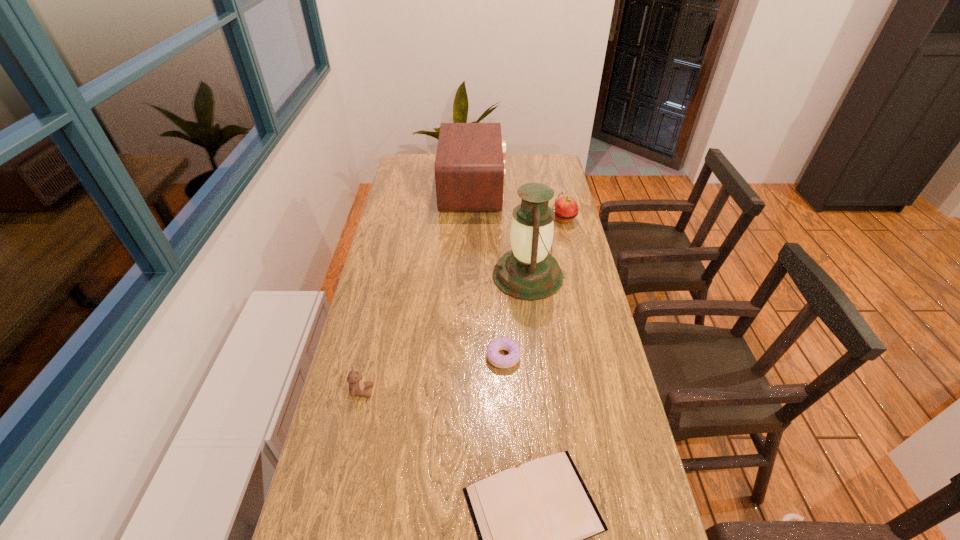
Find the location of a particular element. This screenshot has width=960, height=540. free space located with the light compartment facing forward on the tallest object is located at coordinates click(x=467, y=276).

The height and width of the screenshot is (540, 960). Find the location of `vacant region located on the front panel of the radio receiver`. vacant region located on the front panel of the radio receiver is located at coordinates (561, 189).

Identify the location of free space located on the left of the apple. This screenshot has width=960, height=540. (460, 219).

Find the location of a particular element. The image size is (960, 540). vacant space located on the front-facing side of the leftmost object is located at coordinates (428, 392).

I want to click on free location located 0.300m on the front of the second shortest object, so click(x=509, y=479).

Identify the location of object located in the far edge section of the desktop. The image size is (960, 540). (469, 167).

Identify the location of object located in the left edge section of the desktop. The image size is (960, 540). (357, 387).

In order to click on lantern located at the right edge in this screenshot , I will do `click(529, 272)`.

This screenshot has width=960, height=540. Identify the location of apple that is at the right edge. (566, 209).

You are a GUI agent. You are given a task and a screenshot of the screen. Output one action in this format:
    pyautogui.click(x=<x>, y=<y>)
    Task: Click on the vacant space at the left edge of the desktop
    Image resolution: width=960 pixels, height=540 pixels.
    Given the screenshot: What is the action you would take?
    click(420, 228)